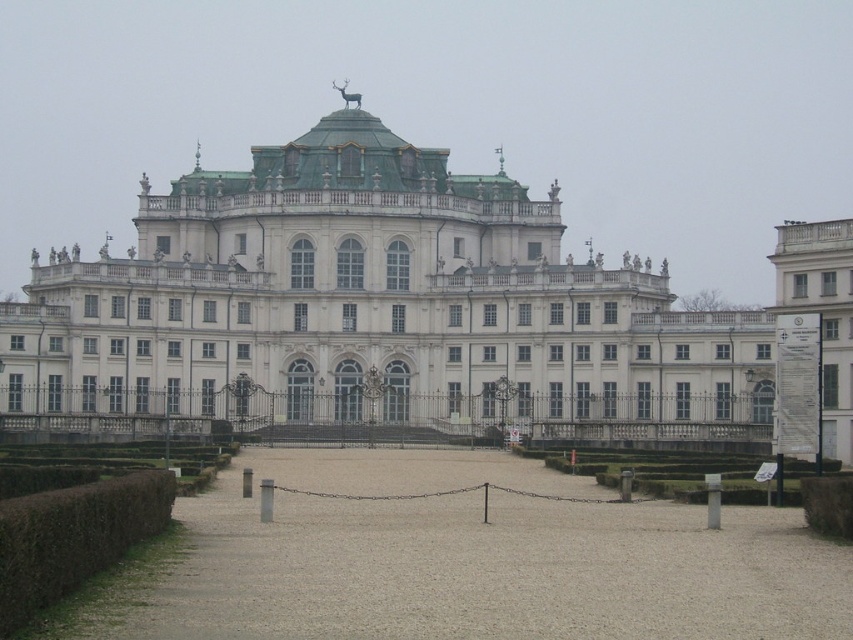
Which is below, brown gravel path at center or green leafy hedge at lower left?

brown gravel path at center is lower down.

Looking at this image, is brown gravel path at center further to camera compared to green leafy hedge at lower left?

That is True.

Does point (505, 561) lie in front of point (90, 477)?

Yes, point (505, 561) is in front of point (90, 477).

The height and width of the screenshot is (640, 853). What are the coordinates of `brown gravel path at center` in the screenshot? It's located at (469, 561).

Who is shorter, white stone palace at center or green leafy hedge at lower left?

green leafy hedge at lower left is shorter.

Does white stone palace at center lie in front of green leafy hedge at lower left?

No, white stone palace at center is further to the viewer.

Is point (641, 416) positioned before point (6, 506)?

No.

Where is `white stone palace at center`? The width and height of the screenshot is (853, 640). white stone palace at center is located at coordinates (368, 304).

Is white stone palace at center positioned in front of brown gravel path at center?

No, it is behind brown gravel path at center.

Identify the location of white stone palace at center. The image size is (853, 640). [x=368, y=304].